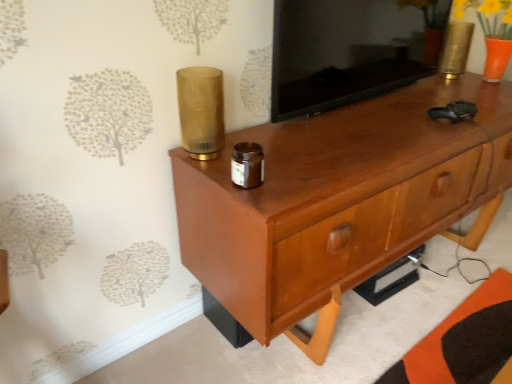
Question: From a real-world perspective, is matte wood tv cabinet at upper center positioned above or below glossy wood chest of drawers at center?

Choices:
 (A) below
 (B) above

Answer: (B)

Question: In the image, is matte wood tv cabinet at upper center positioned in front of or behind glossy wood chest of drawers at center?

Choices:
 (A) front
 (B) behind

Answer: (B)

Question: Which is nearer to the glossy wood chest of drawers at center?

Choices:
 (A) translucent amber glass at upper center, the second candle holder when ordered from top to bottom
 (B) gold metallic vase at upper right, the 2th candle holder from the front
 (C) matte wood tv cabinet at upper center

Answer: (C)

Question: Which is nearer to the matte wood tv cabinet at upper center?

Choices:
 (A) gold metallic vase at upper right, placed as the 1th candle holder when sorted from top to bottom
 (B) translucent amber glass at upper center, arranged as the first candle holder when viewed from the front
 (C) glossy wood chest of drawers at center

Answer: (C)